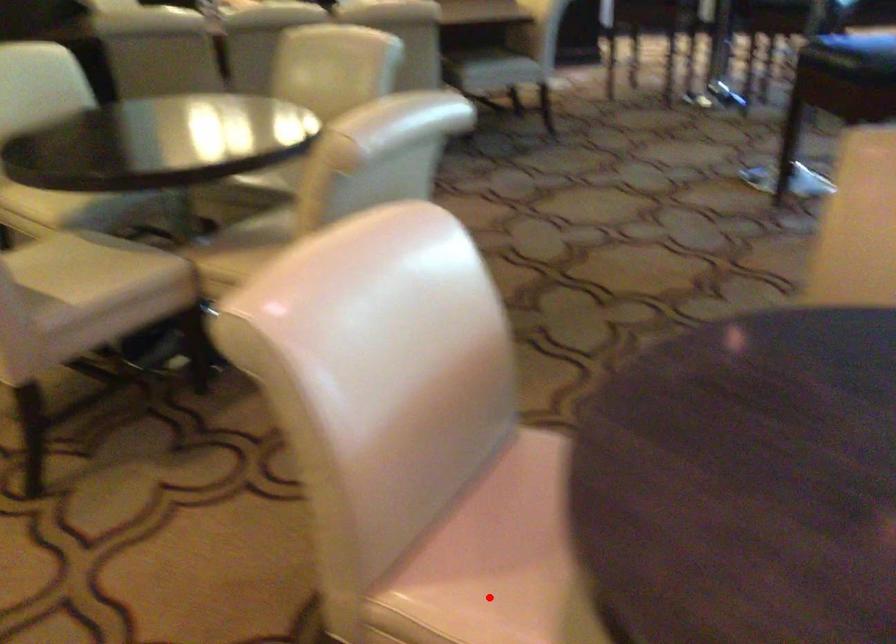
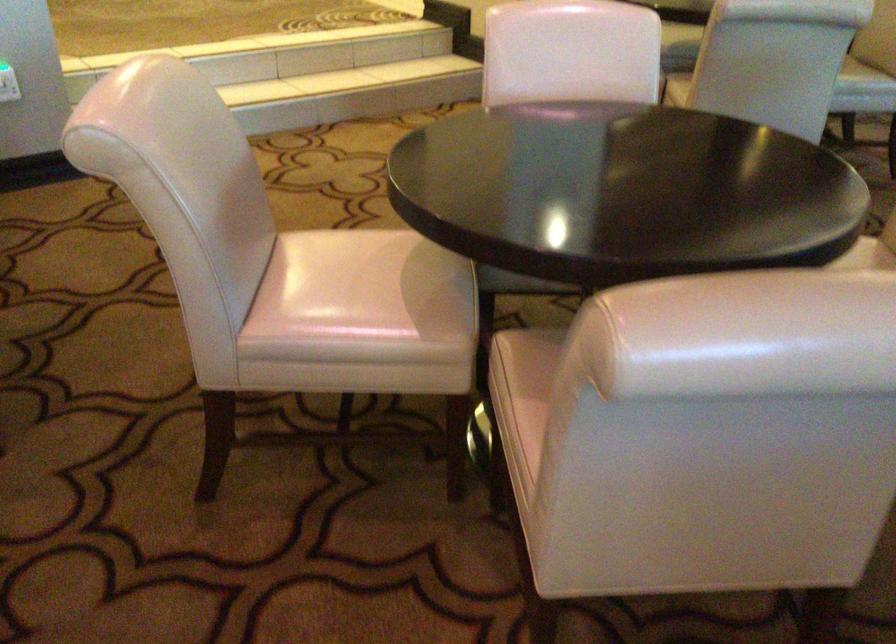
Question: I am providing you with two images of the same scene from different viewpoints. A red point is marked on the first image. Can you still see the location of the red point in image 2?

Choices:
 (A) Yes
 (B) No

Answer: (B)